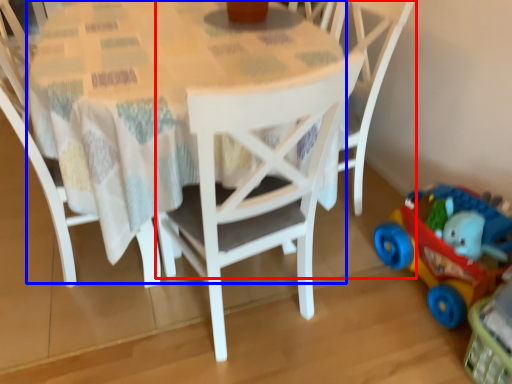
Question: Which object is closer to the camera taking this photo, chair (highlighted by a red box) or round table (highlighted by a blue box)?

Choices:
 (A) chair
 (B) round table

Answer: (B)